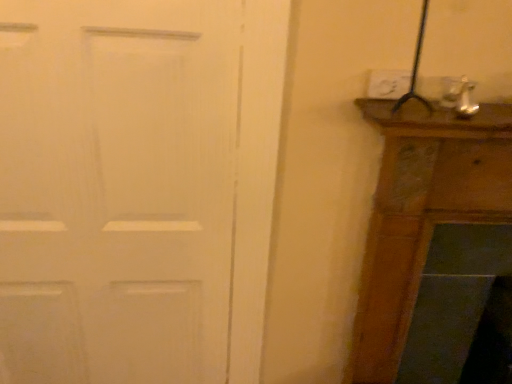
Question: Should I look upward or downward to see white plastic electric outlet at upper right?

Choices:
 (A) down
 (B) up

Answer: (B)

Question: Can white matte door at left be found inside white plastic electric outlet at upper right?

Choices:
 (A) no
 (B) yes

Answer: (A)

Question: Considering the relative positions of white plastic electric outlet at upper right and white matte door at left in the image provided, is white plastic electric outlet at upper right to the left of white matte door at left from the viewer's perspective?

Choices:
 (A) no
 (B) yes

Answer: (A)

Question: Is white plastic electric outlet at upper right looking in the opposite direction of white matte door at left?

Choices:
 (A) no
 (B) yes

Answer: (A)

Question: Does white plastic electric outlet at upper right have a lesser width compared to white matte door at left?

Choices:
 (A) yes
 (B) no

Answer: (A)

Question: From a real-world perspective, is white plastic electric outlet at upper right located beneath white matte door at left?

Choices:
 (A) no
 (B) yes

Answer: (A)

Question: Is white plastic electric outlet at upper right bigger than white matte door at left?

Choices:
 (A) no
 (B) yes

Answer: (A)

Question: Is white matte door at left taller than white plastic electric outlet at upper right?

Choices:
 (A) no
 (B) yes

Answer: (B)

Question: From a real-world perspective, is white matte door at left on top of white plastic electric outlet at upper right?

Choices:
 (A) yes
 (B) no

Answer: (B)

Question: From the image's perspective, is white matte door at left below white plastic electric outlet at upper right?

Choices:
 (A) yes
 (B) no

Answer: (A)

Question: Is white matte door at left not close to white plastic electric outlet at upper right?

Choices:
 (A) yes
 (B) no

Answer: (B)

Question: Is white matte door at left shorter than white plastic electric outlet at upper right?

Choices:
 (A) no
 (B) yes

Answer: (A)

Question: Is white matte door at left touching white plastic electric outlet at upper right?

Choices:
 (A) yes
 (B) no

Answer: (B)

Question: From a real-world perspective, is white matte door at left above or below white plastic electric outlet at upper right?

Choices:
 (A) above
 (B) below

Answer: (B)